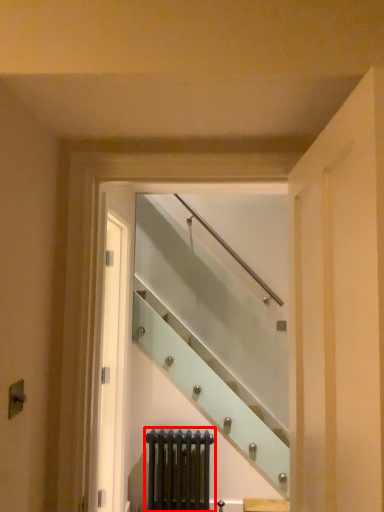
Question: From the image's perspective, where is radiator (annotated by the red box) located in relation to escalator in the image?

Choices:
 (A) below
 (B) above

Answer: (A)